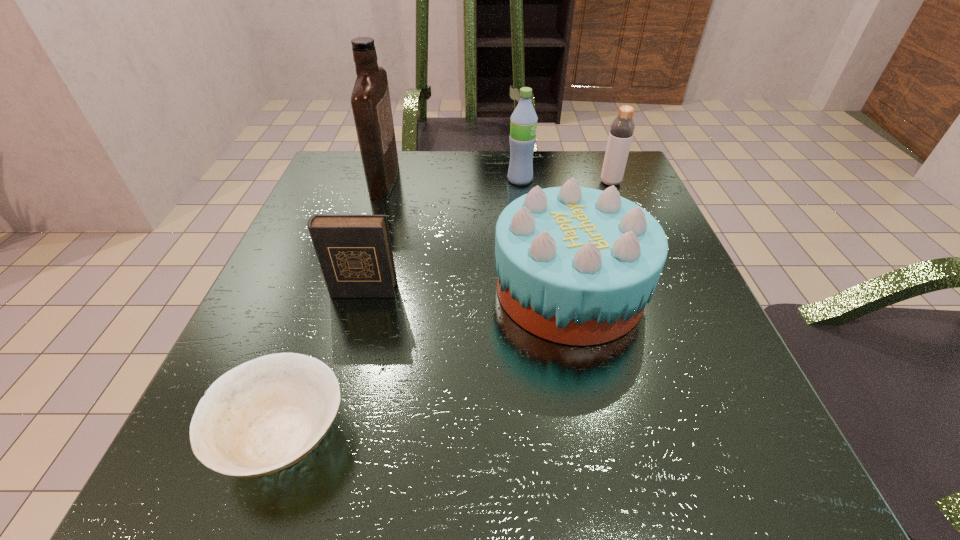
You are a GUI agent. You are given a task and a screenshot of the screen. Output one action in this format:
    pyautogui.click(x=<x>, y=<y>)
    Task: Click on the bottle that is at the right edge
    
    Given the screenshot: What is the action you would take?
    pyautogui.click(x=622, y=128)

The height and width of the screenshot is (540, 960). In order to click on cake that is at the right edge in this screenshot , I will do `click(575, 265)`.

The image size is (960, 540). I want to click on object positioned at the far left corner, so click(370, 100).

At what (x,y) coordinates should I click in order to perform the action: click on object that is at the near left corner. Please return your answer as a coordinate pair (x, y). This screenshot has height=540, width=960. Looking at the image, I should click on (264, 415).

You are a GUI agent. You are given a task and a screenshot of the screen. Output one action in this format:
    pyautogui.click(x=<x>, y=<y>)
    Task: Click on the object at the far right corner
    The width and height of the screenshot is (960, 540).
    Given the screenshot: What is the action you would take?
    pyautogui.click(x=622, y=128)

In the image, there is a desktop. Where is `vacant region at the far edge`? The width and height of the screenshot is (960, 540). vacant region at the far edge is located at coordinates (429, 180).

The height and width of the screenshot is (540, 960). In the image, there is a desktop. Find the location of `vacant space at the near edge`. vacant space at the near edge is located at coordinates (537, 449).

This screenshot has width=960, height=540. In the image, there is a desktop. Find the location of `free space at the left edge`. free space at the left edge is located at coordinates (337, 213).

This screenshot has width=960, height=540. In the image, there is a desktop. In order to click on vacant region at the right edge in this screenshot , I will do `click(641, 368)`.

This screenshot has height=540, width=960. In order to click on free spot at the far left corner of the desktop in this screenshot , I will do `click(331, 172)`.